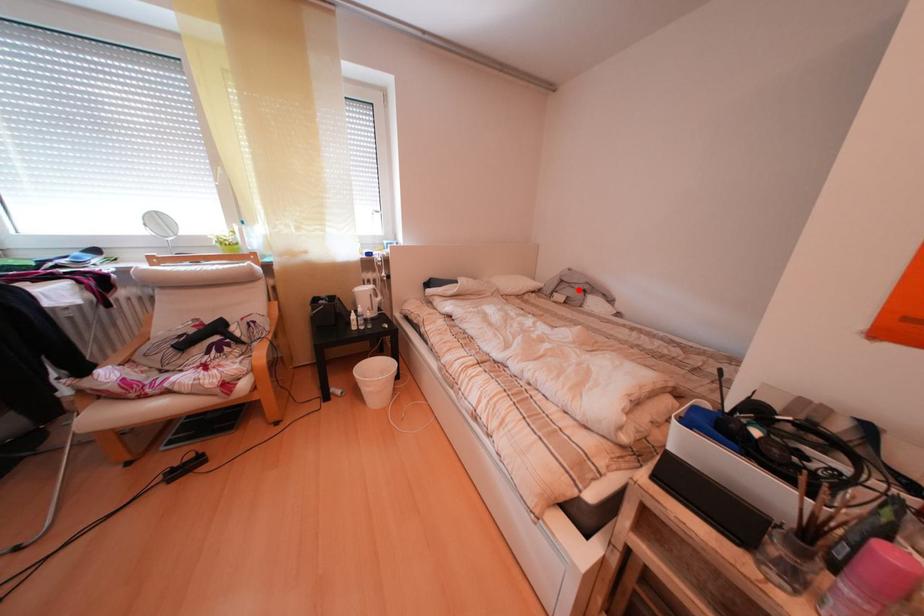
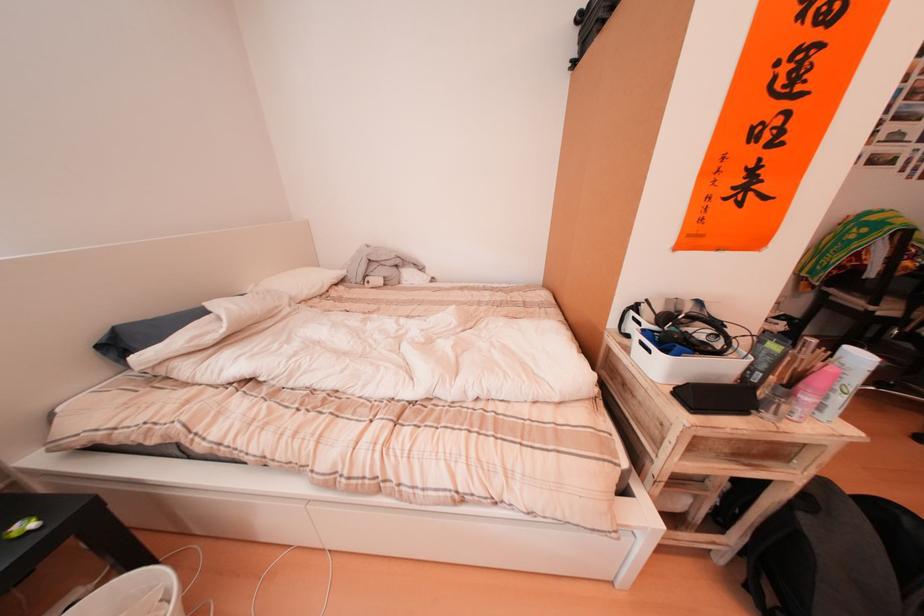
The point at the highlighted location is marked in the first image. Where is the corresponding point in the second image?

(390, 270)